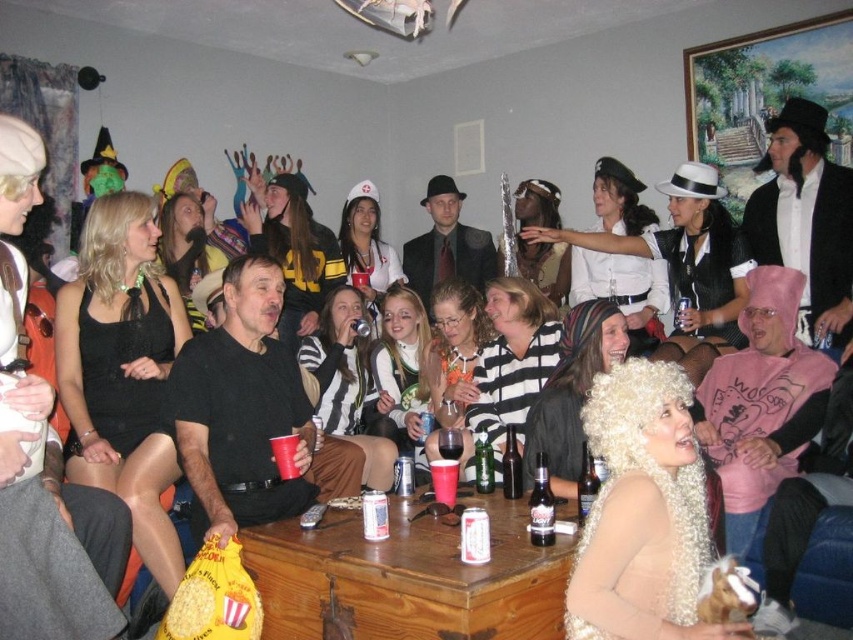
Who is higher up, black satin dress at center or dark brown glass bottle at center?

black satin dress at center

Between point (169, 422) and point (590, 492), which one is positioned in front?

Point (590, 492) is more forward.

Is point (140, 355) closer to viewer compared to point (592, 460)?

No, (140, 355) is behind (592, 460).

The height and width of the screenshot is (640, 853). What are the coordinates of `black satin dress at center` in the screenshot? It's located at (125, 374).

Who is positioned more to the right, black velvet hat at upper right or matte black suit at center?

Positioned to the right is black velvet hat at upper right.

Is point (816, 188) farther from viewer compared to point (467, 227)?

No, it is in front of (467, 227).

I want to click on black velvet hat at upper right, so click(805, 220).

Can you confirm if black velvet hat at upper right is positioned to the right of translucent plastic cup at center?

Correct, you'll find black velvet hat at upper right to the right of translucent plastic cup at center.

Between black velvet hat at upper right and translucent plastic cup at center, which one appears on the left side from the viewer's perspective?

translucent plastic cup at center is more to the left.

In order to click on black velvet hat at upper right in this screenshot , I will do `click(805, 220)`.